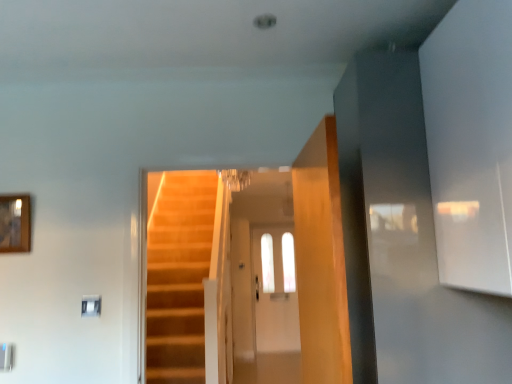
Question: From a real-world perspective, is wooden framed mirror at upper left physically located above or below clear glass door at center?

Choices:
 (A) below
 (B) above

Answer: (B)

Question: Is wooden framed mirror at upper left taller or shorter than clear glass door at center?

Choices:
 (A) tall
 (B) short

Answer: (B)

Question: Considering the positions of wooden framed mirror at upper left and clear glass door at center in the image, is wooden framed mirror at upper left wider or thinner than clear glass door at center?

Choices:
 (A) wide
 (B) thin

Answer: (B)

Question: Is clear glass door at center to the left or to the right of wooden framed mirror at upper left in the image?

Choices:
 (A) left
 (B) right

Answer: (B)

Question: Considering their positions, is clear glass door at center located in front of or behind wooden framed mirror at upper left?

Choices:
 (A) front
 (B) behind

Answer: (B)

Question: Would you say clear glass door at center is inside or outside wooden framed mirror at upper left?

Choices:
 (A) outside
 (B) inside

Answer: (A)

Question: From a real-world perspective, is clear glass door at center positioned above or below wooden framed mirror at upper left?

Choices:
 (A) above
 (B) below

Answer: (B)